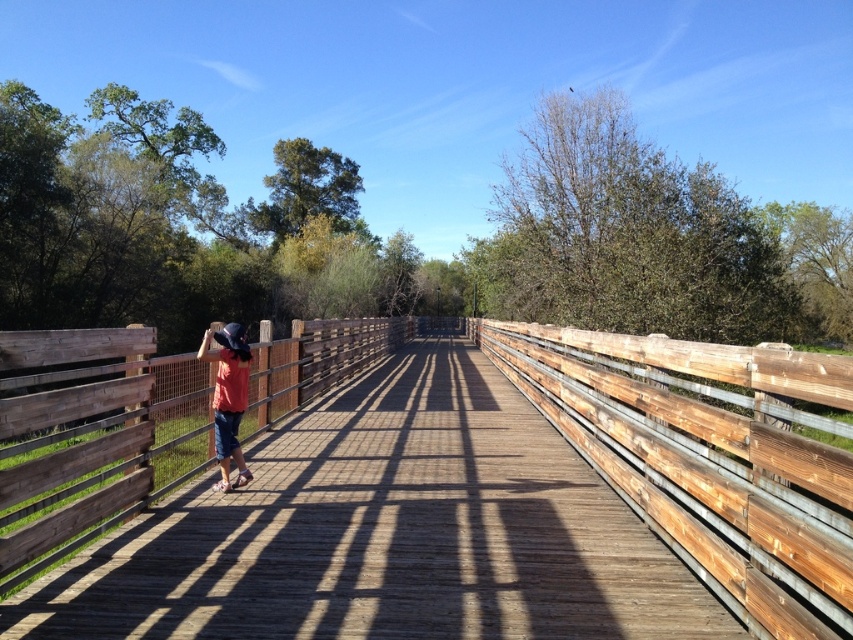
Question: Among these points, which one is farthest from the camera?

Choices:
 (A) (239, 406)
 (B) (467, 573)

Answer: (A)

Question: Is wooden bridge at center closer to the viewer compared to denim shorts at left?

Choices:
 (A) no
 (B) yes

Answer: (B)

Question: Which point is farther to the camera?

Choices:
 (A) denim shorts at left
 (B) wooden bridge at center

Answer: (A)

Question: Does wooden bridge at center have a smaller size compared to denim shorts at left?

Choices:
 (A) yes
 (B) no

Answer: (B)

Question: Can you confirm if wooden bridge at center is smaller than denim shorts at left?

Choices:
 (A) no
 (B) yes

Answer: (A)